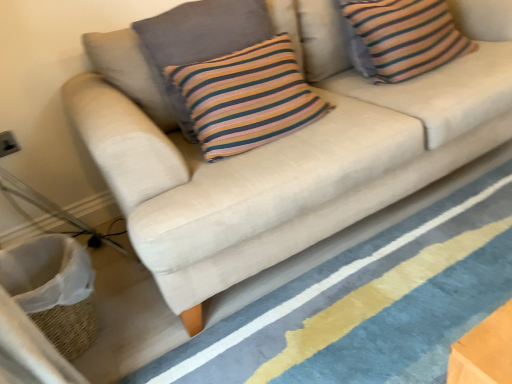
The height and width of the screenshot is (384, 512). Identify the location of beige fabric sofa at lower center. click(x=368, y=304).

Locate an element on the screen. the 2nd pillow behind the white woven basket at lower left, counting from the anchor's position is located at coordinates (405, 37).

Is striped cotton cushion at upper right, the first pillow when ordered from right to left, aimed at white woven basket at lower left?

No, striped cotton cushion at upper right, the first pillow when ordered from right to left, is not oriented towards white woven basket at lower left.

Which object is thinner, striped cotton cushion at upper right, the first pillow when ordered from right to left, or white woven basket at lower left?

With smaller width is striped cotton cushion at upper right, the first pillow when ordered from right to left.

Between beige fabric sofa at lower center and striped cotton cushion at upper right, which is the 2th pillow in left-to-right order, which one appears on the left side from the viewer's perspective?

beige fabric sofa at lower center is more to the left.

Is beige fabric sofa at lower center surrounding striped cotton cushion at upper right, which is the 2th pillow in left-to-right order?

Answer: No.

From the picture: Does beige fabric sofa at lower center touch striped cotton cushion at upper right, which is the 2th pillow in left-to-right order?

No, beige fabric sofa at lower center is not beside striped cotton cushion at upper right, which is the 2th pillow in left-to-right order.

From the image's perspective, which pillow is the 2nd one above the beige fabric sofa at lower center? Please provide its 2D coordinates.

[(405, 37)]

From the image's perspective, which one is positioned lower, striped cotton cushion at upper right, the first pillow when ordered from right to left, or beige fabric sofa at lower center?

From the image's view, beige fabric sofa at lower center is below.

Are striped cotton cushion at upper right, which is the 2th pillow in left-to-right order, and beige fabric sofa at lower center beside each other?

striped cotton cushion at upper right, which is the 2th pillow in left-to-right order, and beige fabric sofa at lower center are not in contact.

Relative to beige fabric sofa at lower center, is striped cotton cushion at upper right, the first pillow when ordered from right to left, in front or behind?

Visually, striped cotton cushion at upper right, the first pillow when ordered from right to left, is located behind beige fabric sofa at lower center.

Which is farther, (469, 205) or (89, 307)?

The point (469, 205) is behind.

At what (x,y) coordinates should I click in order to perform the action: click on basket located behind the beige fabric sofa at lower center. Please return your answer as a coordinate pair (x, y). The height and width of the screenshot is (384, 512). Looking at the image, I should click on (53, 289).

Can you confirm if beige fabric sofa at lower center is shorter than white woven basket at lower left?

Yes.

How different are the orientations of beige fabric sofa at lower center and white woven basket at lower left in degrees?

The angular difference between beige fabric sofa at lower center and white woven basket at lower left is 89.5 degrees.

Is beige fabric sofa at lower center in contact with knitted cotton pillow at center, the 2th pillow in the right-to-left sequence?

No, beige fabric sofa at lower center is not touching knitted cotton pillow at center, the 2th pillow in the right-to-left sequence.

Considering the relative sizes of beige fabric sofa at lower center and knitted cotton pillow at center, the 2th pillow in the right-to-left sequence, in the image provided, is beige fabric sofa at lower center bigger than knitted cotton pillow at center, the 2th pillow in the right-to-left sequence,?

Yes, beige fabric sofa at lower center is bigger than knitted cotton pillow at center, the 2th pillow in the right-to-left sequence.

From the image's perspective, who appears lower, white woven basket at lower left or beige fabric sofa at lower center?

white woven basket at lower left is shown below in the image.

Which of these two, white woven basket at lower left or beige fabric sofa at lower center, stands taller?

white woven basket at lower left is taller.

From a real-world perspective, who is located higher, white woven basket at lower left or beige fabric sofa at lower center?

white woven basket at lower left.

Is white woven basket at lower left inside or outside of beige fabric sofa at lower center?

white woven basket at lower left exists outside the volume of beige fabric sofa at lower center.

Is knitted cotton pillow at center, marked as the first pillow in a left-to-right arrangement, facing away from striped cotton cushion at upper right, the first pillow when ordered from right to left?

No, knitted cotton pillow at center, marked as the first pillow in a left-to-right arrangement, is not facing the opposite direction of striped cotton cushion at upper right, the first pillow when ordered from right to left.

From the image's perspective, is knitted cotton pillow at center, marked as the first pillow in a left-to-right arrangement, above striped cotton cushion at upper right, the first pillow when ordered from right to left?

Actually, knitted cotton pillow at center, marked as the first pillow in a left-to-right arrangement, appears below striped cotton cushion at upper right, the first pillow when ordered from right to left, in the image.

Which object is thinner, knitted cotton pillow at center, the 2th pillow in the right-to-left sequence, or striped cotton cushion at upper right, the first pillow when ordered from right to left?

knitted cotton pillow at center, the 2th pillow in the right-to-left sequence.

Where is `basket located in front of the striped cotton cushion at upper right, which is the 2th pillow in left-to-right order`? This screenshot has width=512, height=384. basket located in front of the striped cotton cushion at upper right, which is the 2th pillow in left-to-right order is located at coordinates (53, 289).

This screenshot has width=512, height=384. I want to click on the 2nd pillow above the beige fabric sofa at lower center (from the image's perspective), so click(x=405, y=37).

When comparing their distances from striped cotton cushion at upper right, the first pillow when ordered from right to left, does beige fabric sofa at lower center or white woven basket at lower left seem closer?

beige fabric sofa at lower center is closer to striped cotton cushion at upper right, the first pillow when ordered from right to left.

From the image, which object appears to be nearer to beige fabric sofa at lower center, knitted cotton pillow at center, marked as the first pillow in a left-to-right arrangement, or white woven basket at lower left?

Based on the image, white woven basket at lower left appears to be nearer to beige fabric sofa at lower center.

From the image, which object appears to be farther from knitted cotton pillow at center, the 2th pillow in the right-to-left sequence, striped cotton cushion at upper right, which is the 2th pillow in left-to-right order, or beige fabric sofa at lower center?

beige fabric sofa at lower center is positioned further to the anchor knitted cotton pillow at center, the 2th pillow in the right-to-left sequence.

From the picture: Looking at the image, which one is located further to white woven basket at lower left, striped cotton cushion at upper right, the first pillow when ordered from right to left, or knitted cotton pillow at center, the 2th pillow in the right-to-left sequence?

striped cotton cushion at upper right, the first pillow when ordered from right to left.

Which object lies further to the anchor point knitted cotton pillow at center, the 2th pillow in the right-to-left sequence, beige fabric sofa at lower center or white woven basket at lower left?

Based on the image, beige fabric sofa at lower center appears to be further to knitted cotton pillow at center, the 2th pillow in the right-to-left sequence.

Considering their positions, is beige fabric sofa at lower center positioned closer to white woven basket at lower left than striped cotton cushion at upper right, the first pillow when ordered from right to left?

Based on the image, beige fabric sofa at lower center appears to be nearer to white woven basket at lower left.

Estimate the real-world distances between objects in this image. Which object is further from striped cotton cushion at upper right, the first pillow when ordered from right to left, knitted cotton pillow at center, the 2th pillow in the right-to-left sequence, or beige fabric sofa at lower center?

Based on the image, beige fabric sofa at lower center appears to be further to striped cotton cushion at upper right, the first pillow when ordered from right to left.

Looking at the image, which one is located closer to beige fabric sofa at lower center, white woven basket at lower left or knitted cotton pillow at center, the 2th pillow in the right-to-left sequence?

white woven basket at lower left is positioned closer to the anchor beige fabric sofa at lower center.

Identify the location of pillow between white woven basket at lower left and striped cotton cushion at upper right, which is the 2th pillow in left-to-right order, in the horizontal direction. This screenshot has height=384, width=512. (199, 41).

Where is `pillow between striped cotton cushion at upper right, the first pillow when ordered from right to left, and beige fabric sofa at lower center vertically`? Image resolution: width=512 pixels, height=384 pixels. pillow between striped cotton cushion at upper right, the first pillow when ordered from right to left, and beige fabric sofa at lower center vertically is located at coordinates (199, 41).

Find the location of `stripe between white woven basket at lower left and striped cotton cushion at upper right, which is the 2th pillow in left-to-right order, from left to right`. stripe between white woven basket at lower left and striped cotton cushion at upper right, which is the 2th pillow in left-to-right order, from left to right is located at coordinates (368, 304).

In order to click on pillow situated between white woven basket at lower left and beige fabric sofa at lower center from left to right in this screenshot , I will do pyautogui.click(x=199, y=41).